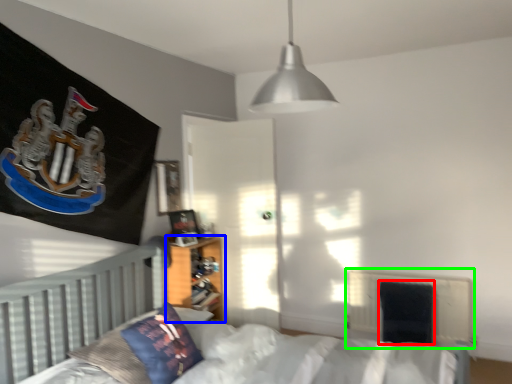
Question: Considering the real-world distances, which object is closest to armchair (highlighted by a red box)? nightstand (highlighted by a blue box) or radiator (highlighted by a green box).

Choices:
 (A) nightstand
 (B) radiator

Answer: (B)